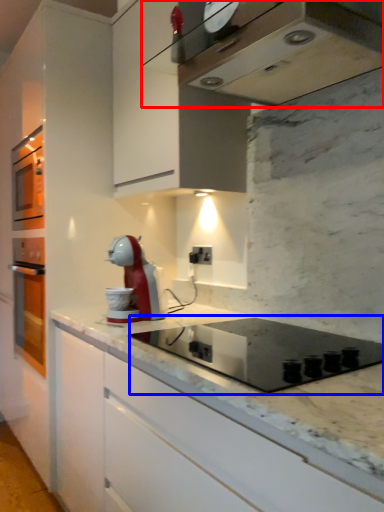
Question: Which object appears farthest to the camera in this image, home appliance (highlighted by a red box) or appliance (highlighted by a blue box)?

Choices:
 (A) home appliance
 (B) appliance

Answer: (B)